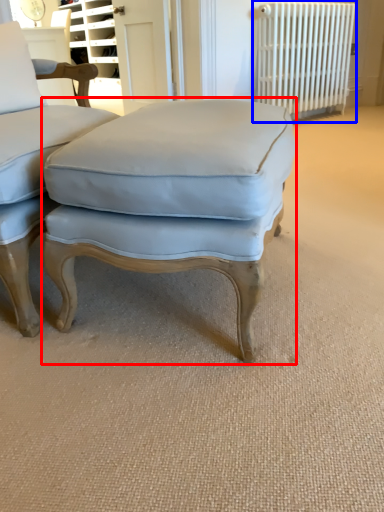
Question: Which point is further to the camera, stool (highlighted by a red box) or radiator (highlighted by a blue box)?

Choices:
 (A) stool
 (B) radiator

Answer: (B)